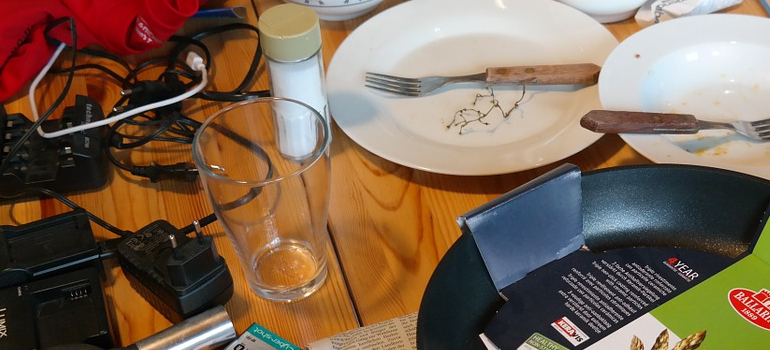
The width and height of the screenshot is (770, 350). I want to click on glass jar, so click(x=313, y=66).